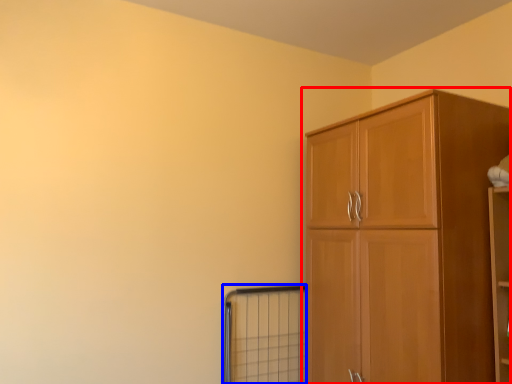
Question: Which of the following is the farthest to the observer, cupboard (highlighted by a red box) or window (highlighted by a blue box)?

Choices:
 (A) cupboard
 (B) window

Answer: (B)